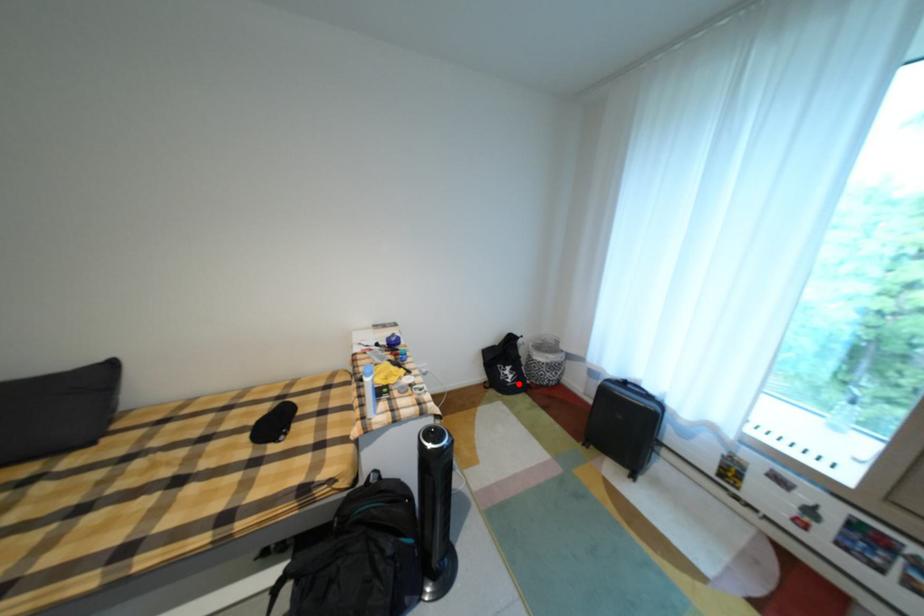
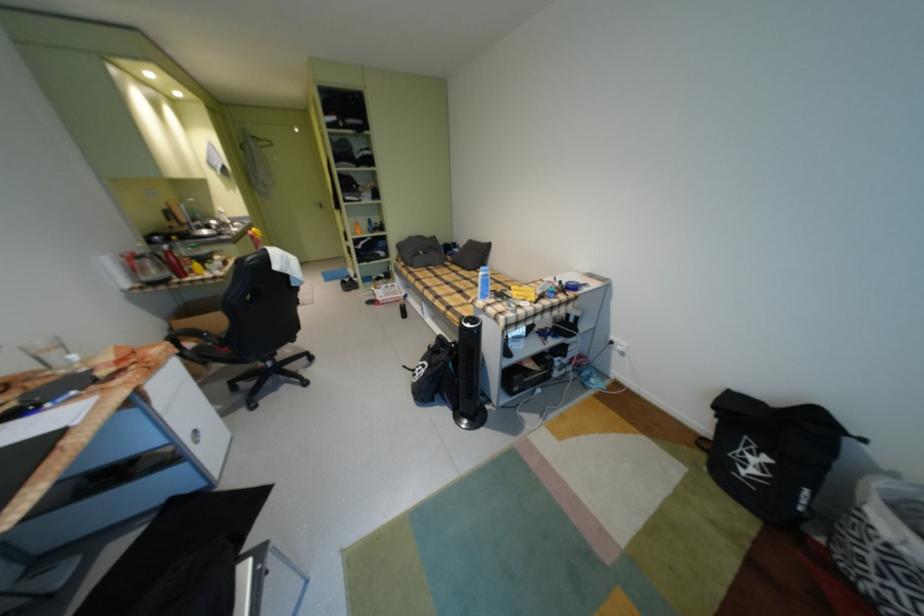
Locate, in the second image, the point that corresponds to the highlighted location in the first image.

(748, 474)